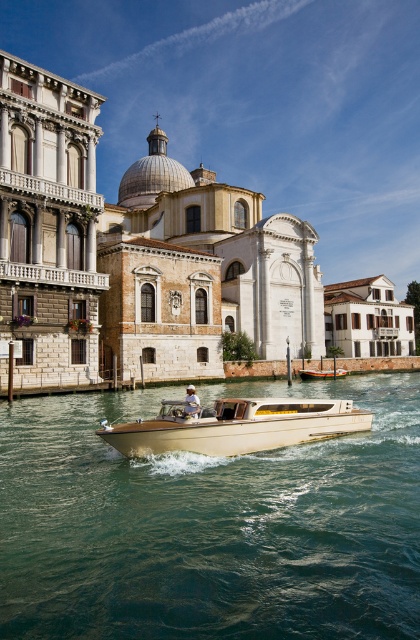
Is clear blue water at center smaller than beige polished wood boat at center?

Incorrect, clear blue water at center is not smaller in size than beige polished wood boat at center.

Is point (356, 465) farther from camera compared to point (286, 433)?

No, it is not.

The image size is (420, 640). In order to click on clear blue water at center in this screenshot , I will do `click(210, 524)`.

Based on the photo, who is lower down, clear blue water at center or wooden polished boat at center?

clear blue water at center is below.

Is clear blue water at center taller than wooden polished boat at center?

Yes.

Identify the location of clear blue water at center. The image size is (420, 640). (210, 524).

Find the location of `clear blue water at center`. clear blue water at center is located at coordinates (210, 524).

Between beige polished wood boat at center and wooden polished boat at center, which one is positioned higher?

wooden polished boat at center is higher up.

Measure the distance between point (204, 452) and camera.

Point (204, 452) is 42.13 meters from camera.

Does point (193, 445) lie in front of point (310, 371)?

Yes, point (193, 445) is in front of point (310, 371).

You are a GUI agent. You are given a task and a screenshot of the screen. Output one action in this format:
    pyautogui.click(x=<x>, y=<y>)
    Task: Click on the beige polished wood boat at center
    
    Given the screenshot: What is the action you would take?
    tap(236, 426)